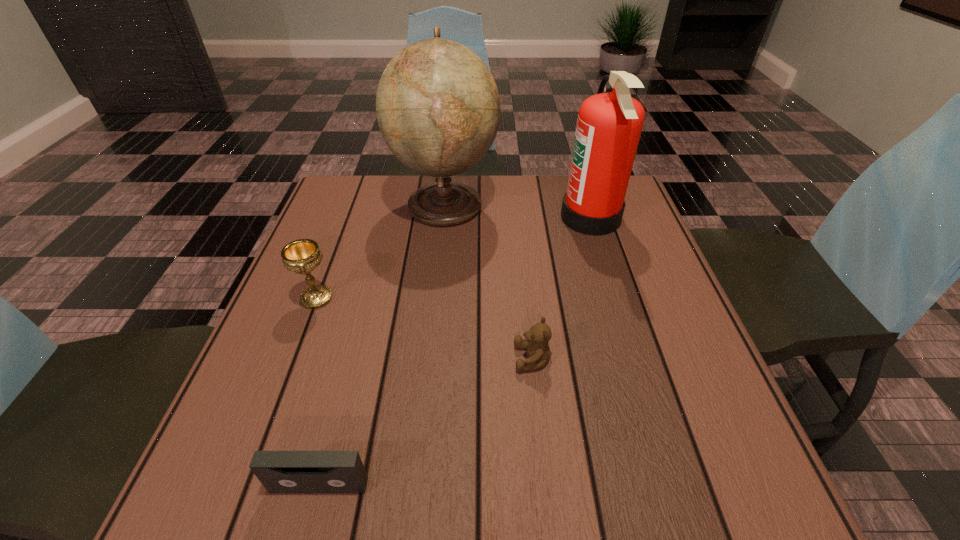
Locate an element on the screen. globe is located at coordinates coord(438,109).

Where is `the rightmost object`? The height and width of the screenshot is (540, 960). the rightmost object is located at coordinates (609, 125).

Locate an element on the screen. the third farthest object is located at coordinates (302, 256).

Find the location of `the third shortest object`. the third shortest object is located at coordinates (302, 256).

Find the location of a particular element. The height and width of the screenshot is (540, 960). the fourth object from left to right is located at coordinates (538, 352).

This screenshot has height=540, width=960. Identify the location of the fourth farthest object. (538, 352).

Where is `videotape`? The height and width of the screenshot is (540, 960). videotape is located at coordinates (279, 471).

Locate an element on the screen. This screenshot has width=960, height=540. vacant area situated on the front-facing side of the globe is located at coordinates (516, 204).

Where is `vacant area located at the nozzle of the fire extinguisher`? The height and width of the screenshot is (540, 960). vacant area located at the nozzle of the fire extinguisher is located at coordinates (527, 218).

At what (x,y) coordinates should I click in order to perform the action: click on vacant space located 0.060m at the nozzle of the fire extinguisher. Please return your answer as a coordinate pair (x, y). Looking at the image, I should click on (539, 218).